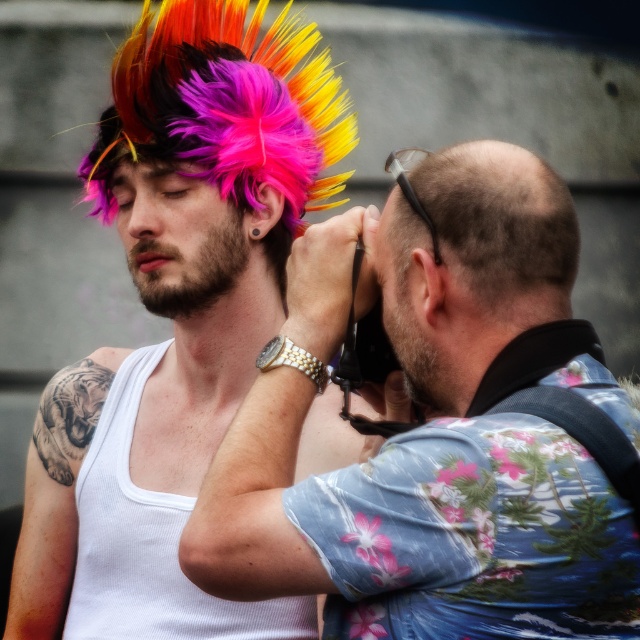
Question: Is floral print shirt at right smaller than floral-patterned shirt at right?

Choices:
 (A) no
 (B) yes

Answer: (B)

Question: Does multicolored feathered wig at center have a lesser width compared to floral-patterned shirt at right?

Choices:
 (A) yes
 (B) no

Answer: (B)

Question: Estimate the real-world distances between objects in this image. Which object is closer to the floral-patterned shirt at center?

Choices:
 (A) floral-patterned shirt at right
 (B) multicolored feathered wig at center
 (C) floral print shirt at right

Answer: (C)

Question: Does floral-patterned shirt at center appear on the left side of floral print shirt at right?

Choices:
 (A) no
 (B) yes

Answer: (B)

Question: Which object appears farthest from the camera in this image?

Choices:
 (A) multicolored feathered wig at center
 (B) floral-patterned shirt at center
 (C) floral print shirt at right
 (D) floral-patterned shirt at right

Answer: (A)

Question: Which point appears farthest from the camera in this image?

Choices:
 (A) (326, 525)
 (B) (180, 259)
 (C) (531, 356)

Answer: (B)